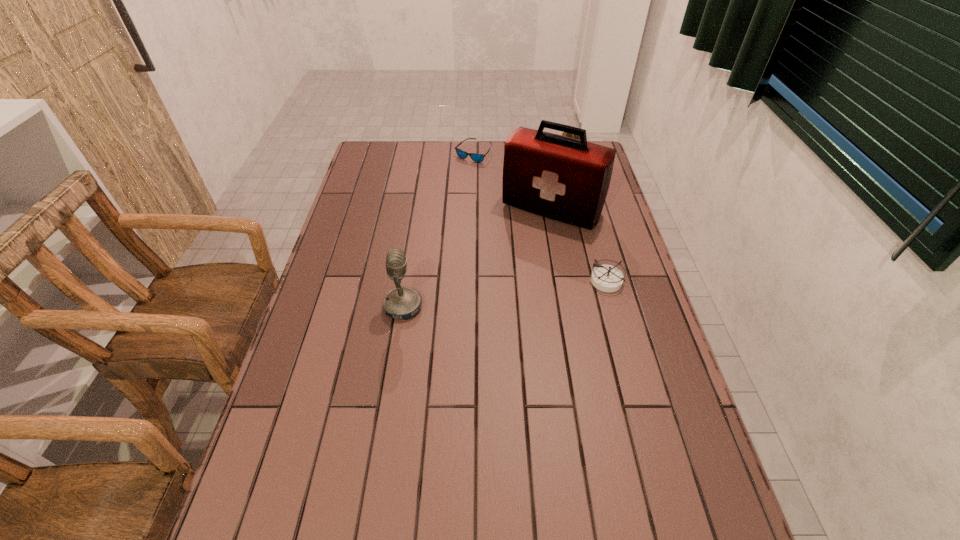
Find the location of a particular element. free space that satisfies the following two spatial constraints: 1. on the front side of the third tallest object; 2. on the right side of the shortest object is located at coordinates (473, 156).